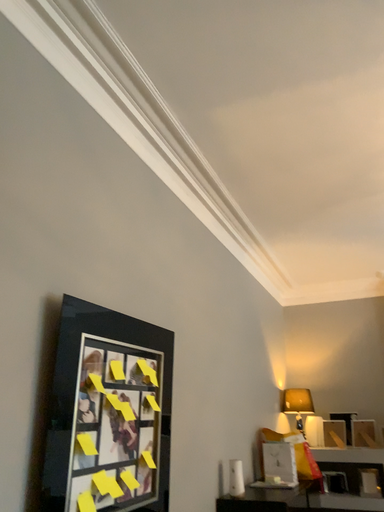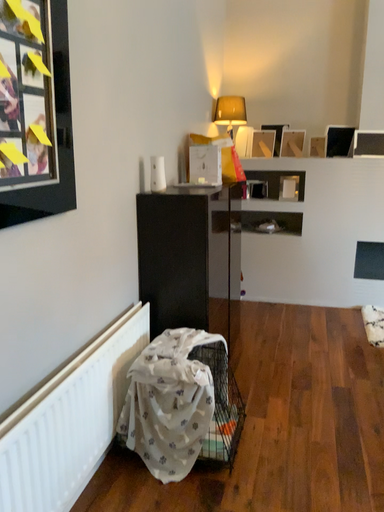
Question: Which way did the camera rotate in the video?

Choices:
 (A) rotated downward
 (B) rotated upward

Answer: (A)